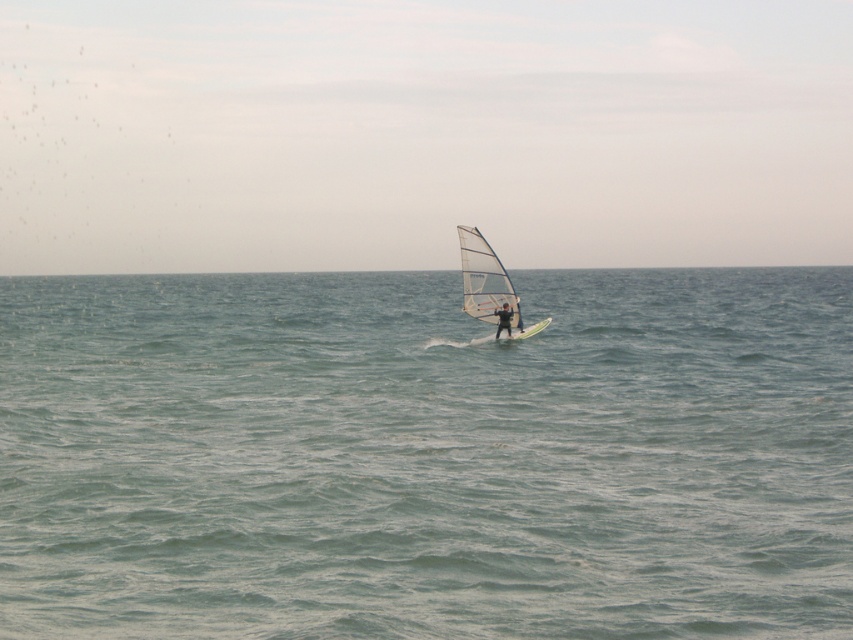
You are a photographer trying to capture the windsurfer in the image. The windsurfer is at point (489,284). To ensure the sail is centered in your shot, where should you aim your camera? Please provide the coordinates as a point in the format point followed by coordinates in parentheses.

The white matte sail at center is represented by point (489,284), so you should aim your camera at point (489,284) to center the sail in your shot.

You are a photographer trying to capture the matte black windsurfer at center and the clear blue water at center in a single shot. Based on their positions, which object will appear larger in your photo?

The clear blue water at center will appear larger in the photo because it is closer to the viewer than the matte black windsurfer at center.